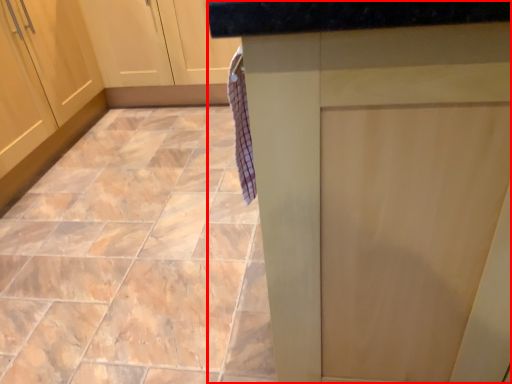
Question: Observing the image, what is the correct spatial positioning of counter (annotated by the red box) in reference to ceramic tile?

Choices:
 (A) left
 (B) right

Answer: (B)